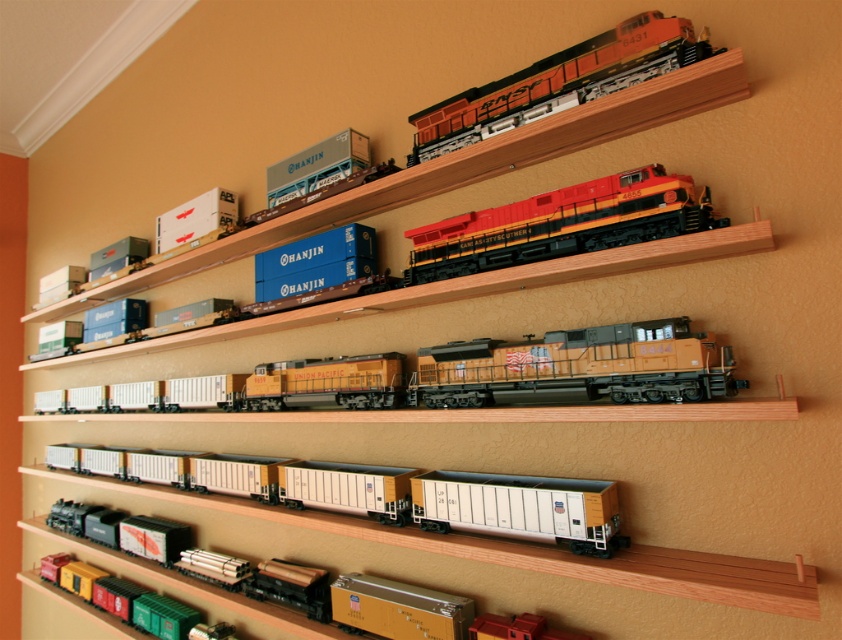
Can you confirm if shiny red/black locomotive at center is wider than orange matte train at upper center?

Indeed, shiny red/black locomotive at center has a greater width compared to orange matte train at upper center.

Does point (453, 243) lie in front of point (441, 122)?

Yes, it is.

Identify the location of shiny red/black locomotive at center. The width and height of the screenshot is (842, 640). (561, 225).

Find the location of `yellow matte locomotive at center`. yellow matte locomotive at center is located at coordinates (497, 372).

Which is below, orange matte train at upper center or metallic blue container at upper center?

metallic blue container at upper center is lower down.

Is point (657, 36) positioned before point (270, 186)?

Yes.

The image size is (842, 640). I want to click on orange matte train at upper center, so click(558, 80).